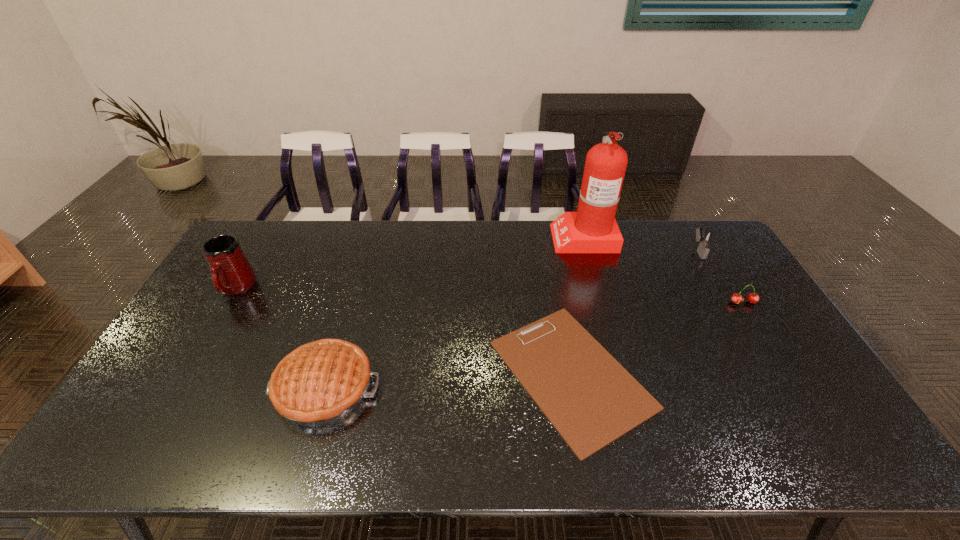
Locate an element on the screen. The height and width of the screenshot is (540, 960). empty space between the igniter and the pie is located at coordinates (512, 320).

This screenshot has width=960, height=540. I want to click on free space between the second object from left to right and the clipboard, so click(x=448, y=381).

The width and height of the screenshot is (960, 540). What are the coordinates of `vacant region between the clipboard and the tallest object` in the screenshot? It's located at (577, 305).

In order to click on vacant area that lies between the igniter and the fire extinguisher in this screenshot , I will do `click(640, 244)`.

Find the location of `unoccupied position between the igniter and the mug`. unoccupied position between the igniter and the mug is located at coordinates (468, 270).

This screenshot has height=540, width=960. Identify the location of free space between the pie and the fire extinguisher. (454, 312).

This screenshot has width=960, height=540. I want to click on unoccupied area between the pie and the fire extinguisher, so click(x=454, y=312).

This screenshot has height=540, width=960. I want to click on object that stands as the fourth closest to the igniter, so click(321, 382).

Identify which object is the third nearest to the pie. Please provide its 2D coordinates. Your answer should be formatted as a tuple, i.e. [(x, y)], where the tuple contains the x and y coordinates of a point satisfying the conditions above.

[(592, 229)]

The image size is (960, 540). Identify the location of vacant space that satisfies the following two spatial constraints: 1. on the side of the fifth shortest object with the handle; 2. on the left side of the shortest object. (185, 374).